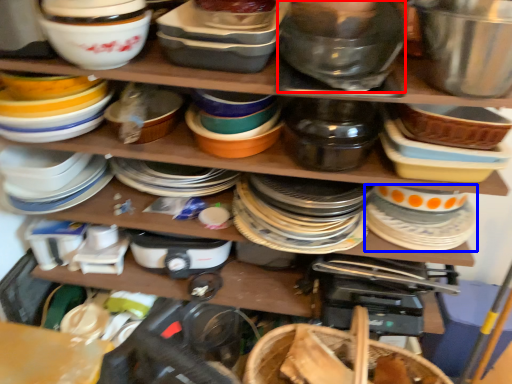
Question: Among these objects, which one is farthest to the camera, bowl (highlighted by a red box) or tableware (highlighted by a blue box)?

Choices:
 (A) bowl
 (B) tableware

Answer: (B)